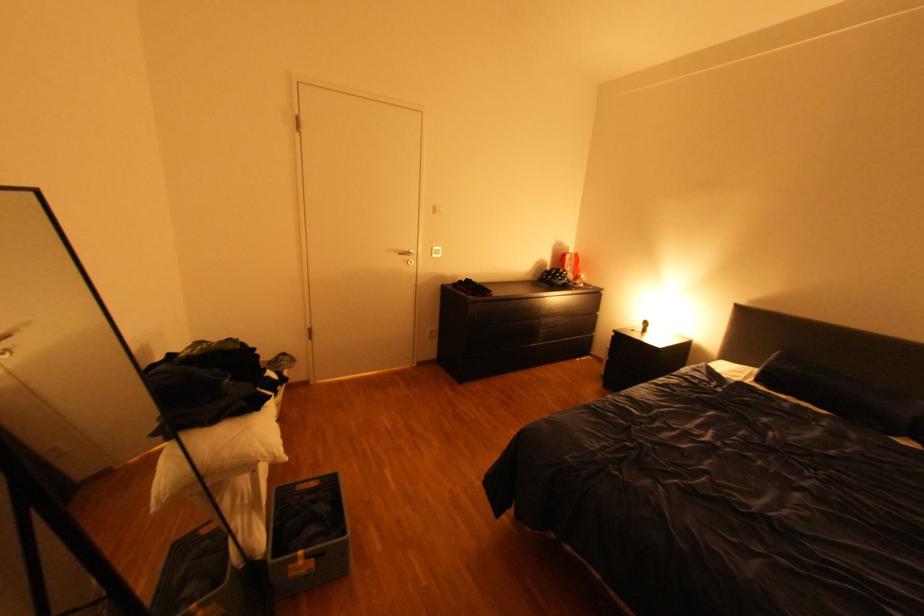
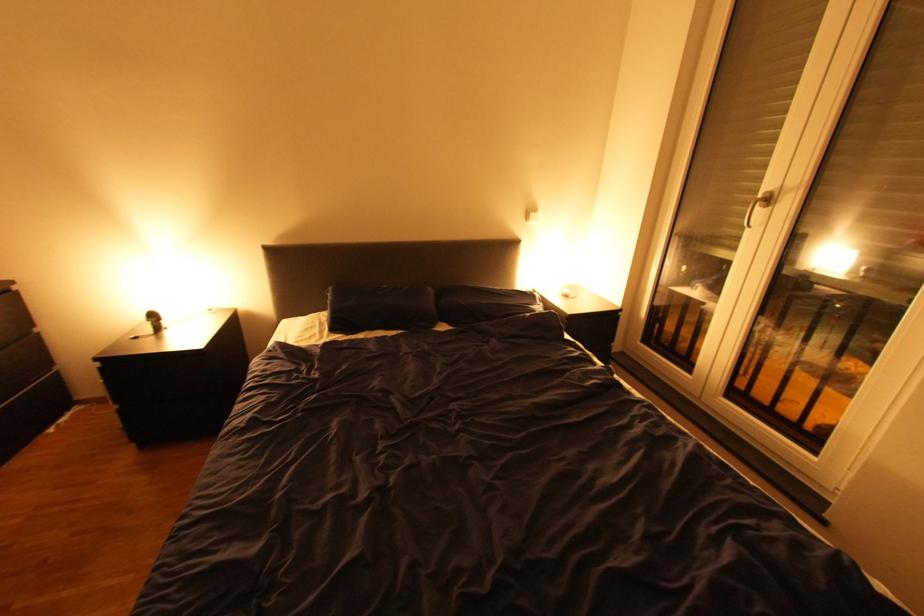
Where in the second image is the point corresponding to pixel 772 386 from the first image?

(348, 333)